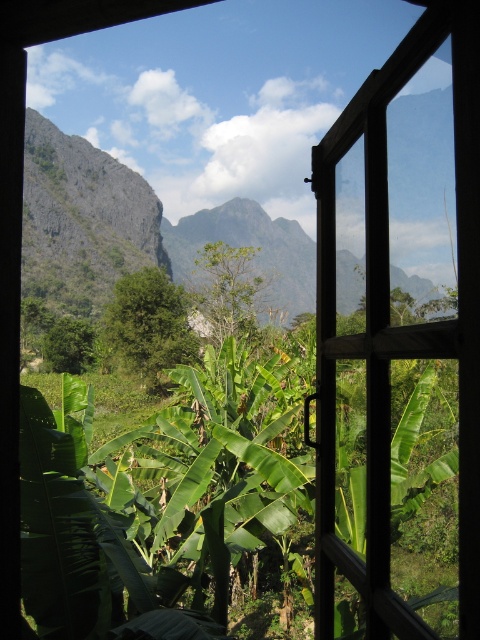
Can you confirm if wooden frame at center is taller than green leafy banana tree at center?

No.

Is wooden frame at center positioned at the back of green leafy banana tree at center?

No, wooden frame at center is closer to the viewer.

The width and height of the screenshot is (480, 640). Describe the element at coordinates (400, 348) in the screenshot. I see `wooden frame at center` at that location.

The image size is (480, 640). In order to click on wooden frame at center in this screenshot , I will do (400, 348).